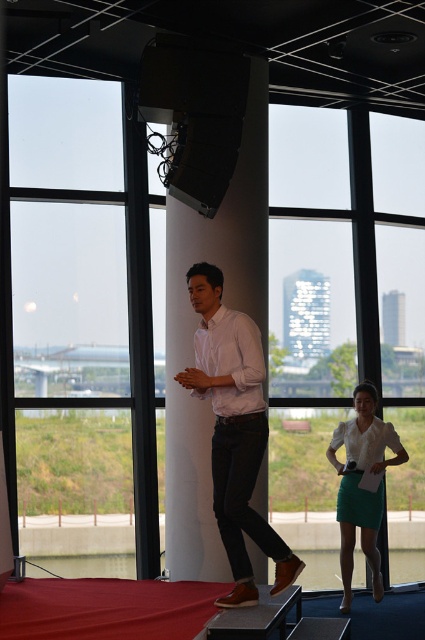
You are an event organizer who needs to ensure that both the presenter and attendee are visible to the audience. The presenter is wearing the white shirt at center, and the attendee is wearing the matte white blouse at center. Based on their positions, which clothing item is more likely to be seen by the audience?

The white shirt at center is positioned over matte white blouse at center, so the white shirt at center is more visible to the audience.

You are an event planner observing the stage setup. You need to determine the order of speakers based on their positions. Which speaker is positioned closer to the front of the stage between the white shirt at center and the matte white blouse at center?

The white shirt at center is closer to the viewer than the matte white blouse at center, so the speaker in the white shirt at center is positioned closer to the front of the stage.

You are organizing a stage event and need to ensure there is enough space between the two presenters. The safety guideline requires at least 2 meters between participants for movement. Can the white shirt at center and the matte white blouse at center maintain this distance?

The white shirt at center and the matte white blouse at center are 2.56 meters apart, which exceeds the 2 meter requirement, so they can maintain the required distance.